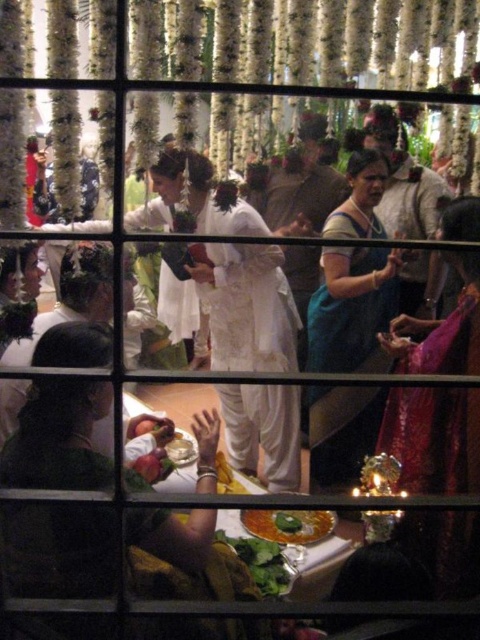
Is silky pink saree at right smaller than white glossy bowl at center?

Incorrect, silky pink saree at right is not smaller in size than white glossy bowl at center.

Who is more forward, (431,472) or (181,461)?

Point (431,472)

Identify the location of silky pink saree at right. (432, 438).

Between teal silk saree at center and green leafy vegetable at lower center, which one appears on the left side from the viewer's perspective?

green leafy vegetable at lower center

Is the position of teal silk saree at center less distant than that of green leafy vegetable at lower center?

No, teal silk saree at center is further to the viewer.

What do you see at coordinates (351, 308) in the screenshot? The width and height of the screenshot is (480, 640). I see `teal silk saree at center` at bounding box center [351, 308].

Where is `teal silk saree at center`? teal silk saree at center is located at coordinates (351, 308).

Is green leafy vegetable at lower center closer to the viewer compared to white glossy bowl at center?

Yes, it is in front of white glossy bowl at center.

Find the location of a particular element. Image resolution: width=480 pixels, height=640 pixels. green leafy vegetable at lower center is located at coordinates (261, 563).